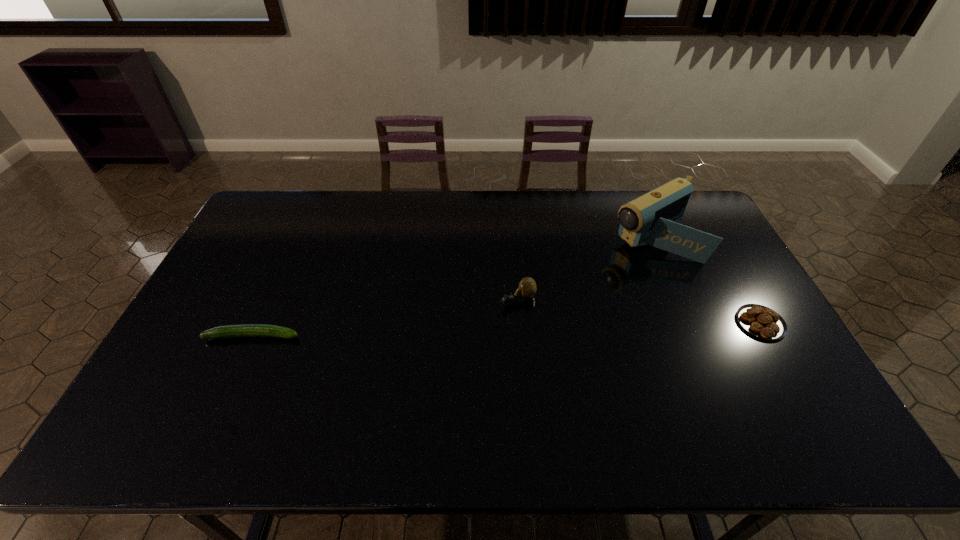
I want to click on vacant space located on the front-facing side of the third object from right to left, so click(x=472, y=320).

This screenshot has width=960, height=540. Find the location of `free spot located on the side of the camcorder with the flip-out screen`. free spot located on the side of the camcorder with the flip-out screen is located at coordinates (539, 300).

Locate an element on the screen. The width and height of the screenshot is (960, 540). vacant position located 0.350m on the side of the camcorder with the flip-out screen is located at coordinates (541, 299).

Identify the location of blank space located on the side of the camcorder with the flip-out screen. This screenshot has width=960, height=540. (559, 289).

Identify the location of object located at the far edge. This screenshot has height=540, width=960. (651, 219).

Find the location of a particular element. object that is at the left edge is located at coordinates (246, 330).

The image size is (960, 540). I want to click on pastry at the right edge, so click(761, 321).

Where is `camcorder that is at the right edge`? camcorder that is at the right edge is located at coordinates (651, 219).

What are the coordinates of `object that is at the far right corner` in the screenshot? It's located at (651, 219).

You are a GUI agent. You are given a task and a screenshot of the screen. Output one action in this format:
    pyautogui.click(x=<x>, y=<y>)
    Task: Click on the vacant space at the far edge of the desktop
    
    Given the screenshot: What is the action you would take?
    pyautogui.click(x=429, y=194)